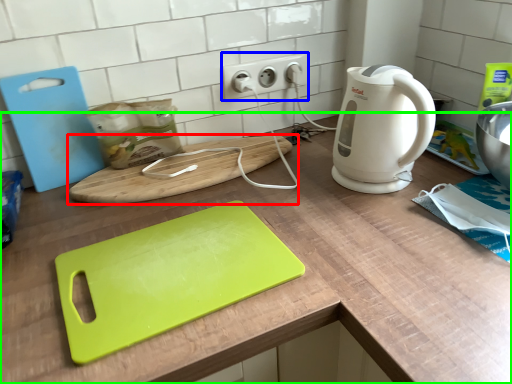
Question: Which object is the closest to the cutting board (highlighted by a red box)? Choose among these: electric outlet (highlighted by a blue box) or counter (highlighted by a green box).

Choices:
 (A) electric outlet
 (B) counter

Answer: (B)